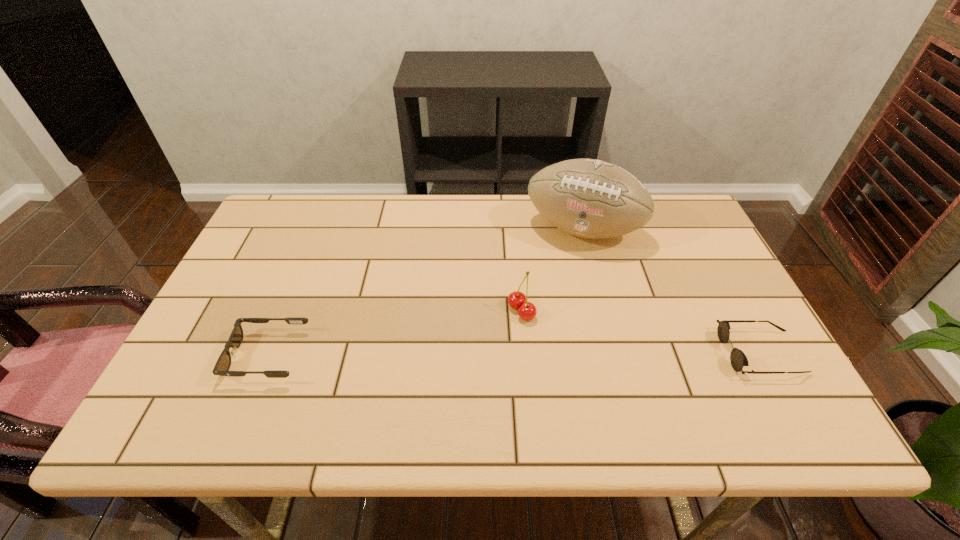
The height and width of the screenshot is (540, 960). In order to click on object at the near left corner in this screenshot , I will do `click(222, 366)`.

Locate an element on the screen. object situated at the near right corner is located at coordinates (738, 359).

Identify the location of free region at the far edge of the desktop. The height and width of the screenshot is (540, 960). (507, 205).

In the image, there is a desktop. Where is `free space at the near edge`? This screenshot has height=540, width=960. free space at the near edge is located at coordinates (473, 367).

In the image, there is a desktop. Where is `free space at the left edge`? free space at the left edge is located at coordinates (234, 311).

Where is `free point at the right edge`? This screenshot has width=960, height=540. free point at the right edge is located at coordinates (765, 342).

What are the coordinates of `vacant space at the far left corner of the desktop` in the screenshot? It's located at (280, 218).

Where is `vacant area at the near left corner of the desktop`? This screenshot has width=960, height=540. vacant area at the near left corner of the desktop is located at coordinates (169, 386).

At what (x,y) coordinates should I click in order to perform the action: click on vacant space at the far right corner. Please return your answer as a coordinate pair (x, y). Looking at the image, I should click on (668, 206).

The height and width of the screenshot is (540, 960). Identify the location of free space between the second object from right to left and the rightmost object. (672, 291).